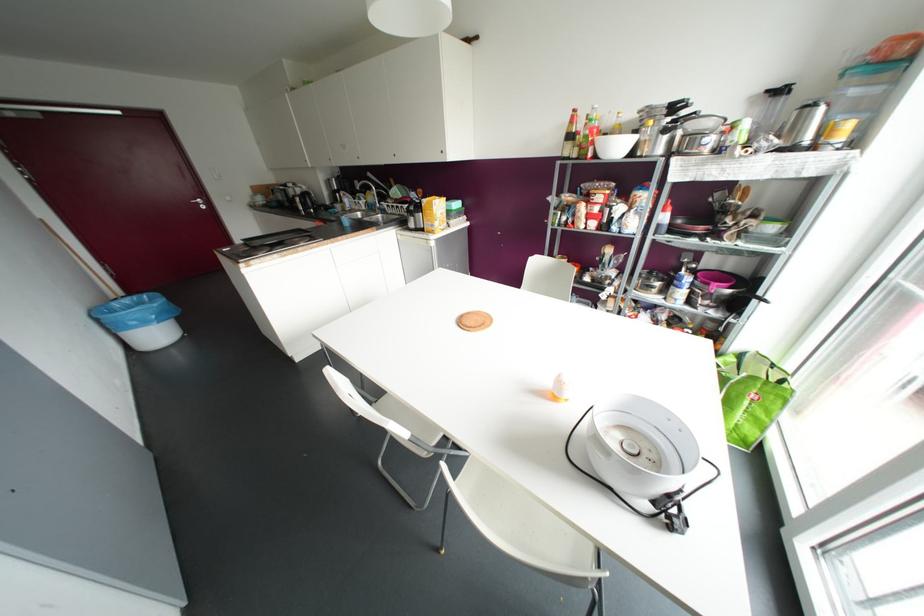
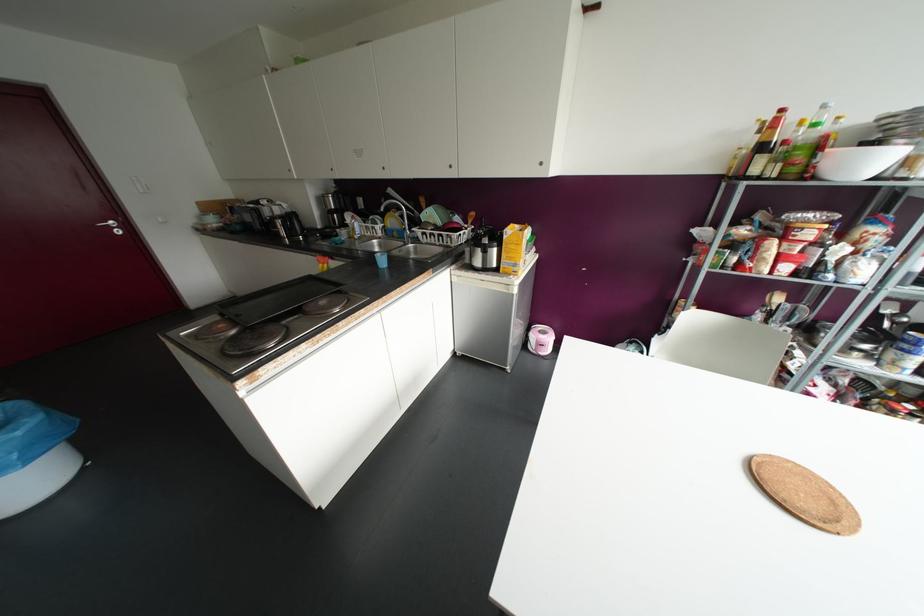
Locate, in the second image, the point that corresponds to (345,222) in the first image.

(382, 261)